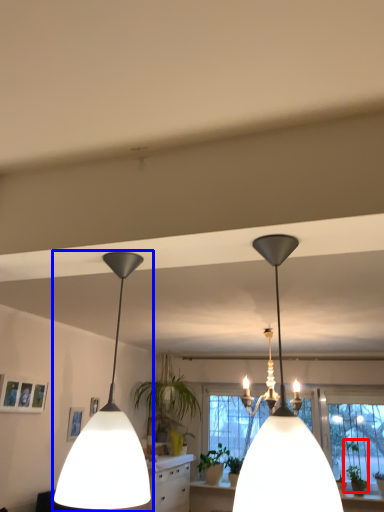
Question: Which of the following is the farthest to the observer, plant (highlighted by a red box) or lamp (highlighted by a blue box)?

Choices:
 (A) plant
 (B) lamp

Answer: (A)